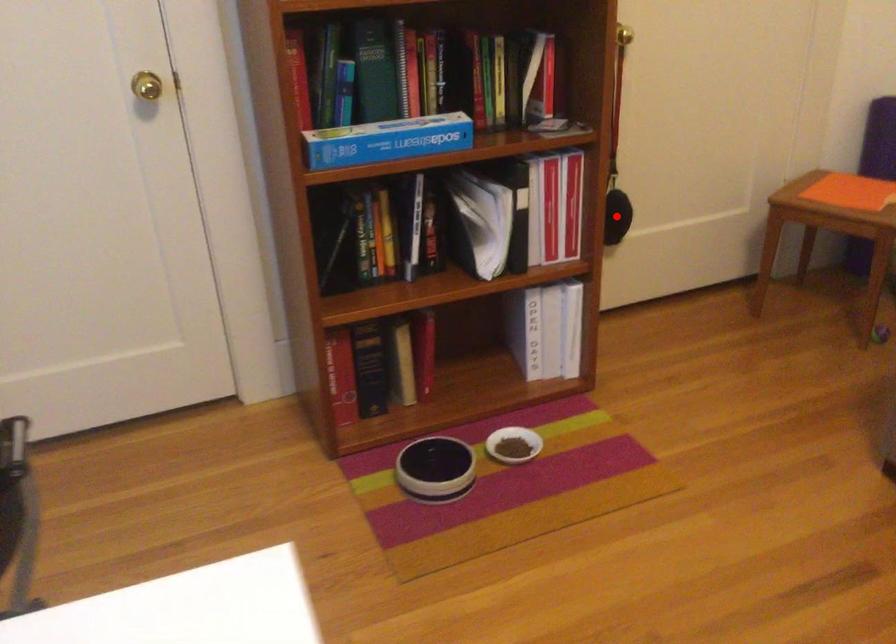
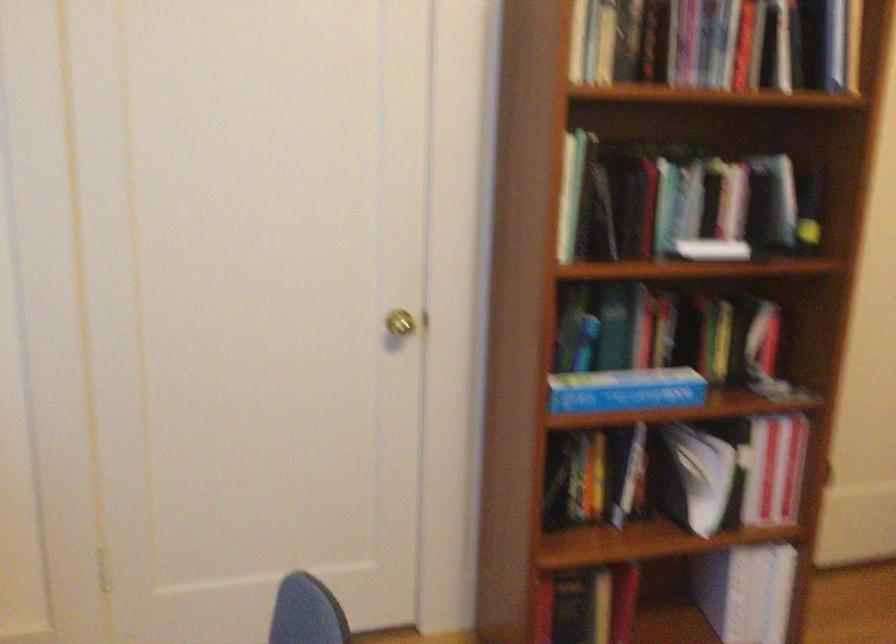
Question: I am providing you with two images of the same scene from different viewpoints. A red point is marked on the first image. Is the red point's position out of view in image 2?

Choices:
 (A) Yes
 (B) No

Answer: (A)